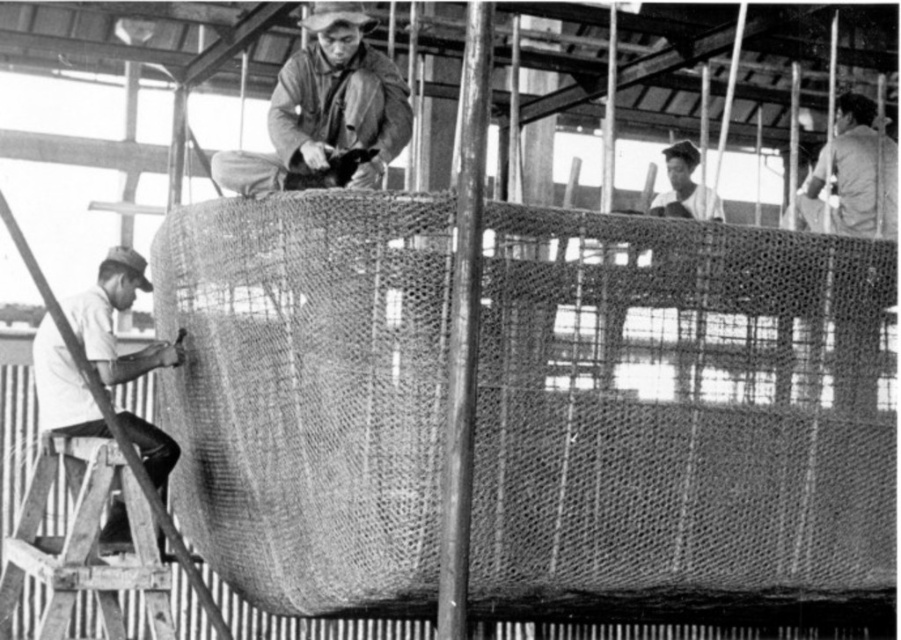
Is wooden at lower left positioned behind dark gray fabric at upper right?

No, it is in front of dark gray fabric at upper right.

Measure the distance from wooden at lower left to dark gray fabric at upper right.

wooden at lower left is 5.35 meters away from dark gray fabric at upper right.

Who is more forward, (62, 461) or (871, 225)?

Point (62, 461)

Locate an element on the screen. wooden at lower left is located at coordinates (84, 541).

Which is more to the left, matte brown jacket at center or dark gray fabric at upper right?

matte brown jacket at center

Can you confirm if matte brown jacket at center is thinner than dark gray fabric at upper right?

In fact, matte brown jacket at center might be wider than dark gray fabric at upper right.

Which is behind, point (316, 138) or point (840, 387)?

Positioned behind is point (316, 138).

The width and height of the screenshot is (901, 640). I want to click on matte brown jacket at center, so click(x=325, y=108).

Is point (142, 269) positioned behind point (856, 189)?

No, it is in front of (856, 189).

Describe the element at coordinates (111, 321) in the screenshot. I see `white matte shirt at lower left` at that location.

At what (x,y) coordinates should I click in order to perform the action: click on white matte shirt at lower left. Please return your answer as a coordinate pair (x, y). Looking at the image, I should click on (111, 321).